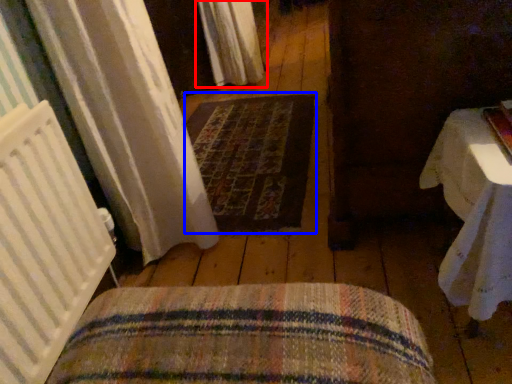
Question: Which object appears closest to the camera in this image, curtain (highlighted by a red box) or mat (highlighted by a blue box)?

Choices:
 (A) curtain
 (B) mat

Answer: (B)